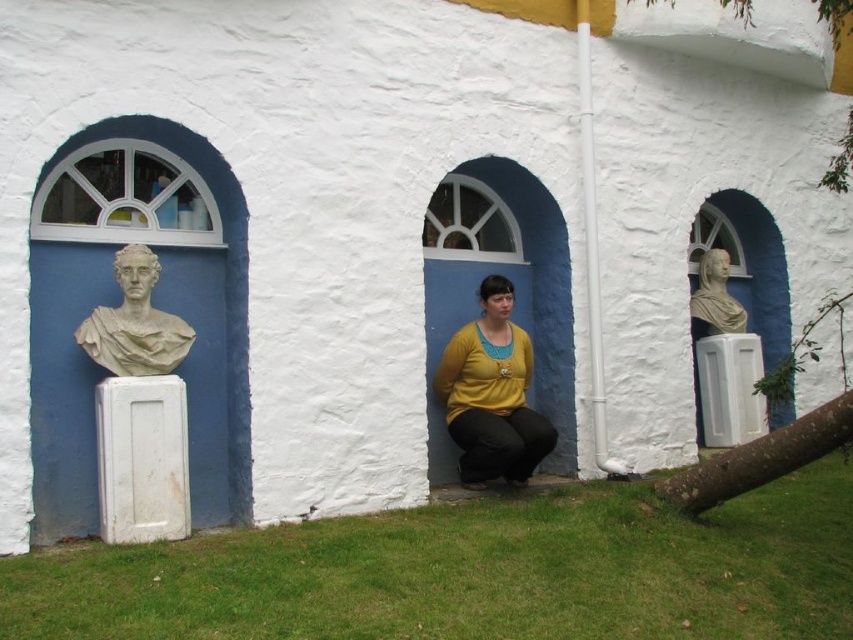
Question: Among these points, which one is nearest to the camera?

Choices:
 (A) (711, 324)
 (B) (788, 397)
 (C) (164, 362)

Answer: (B)

Question: Which point is farther to the camera?

Choices:
 (A) [500, 435]
 (B) [740, 308]
 (C) [113, 321]

Answer: (B)

Question: Which point is closer to the camera?

Choices:
 (A) (166, 317)
 (B) (712, 321)
 (C) (805, 353)
 (D) (473, 404)

Answer: (A)

Question: Is white marble bust at left further to camera compared to white marble bust at center right?

Choices:
 (A) yes
 (B) no

Answer: (B)

Question: In this image, where is white marble bust at left located relative to white marble bust at center right?

Choices:
 (A) left
 (B) right

Answer: (A)

Question: Is white marble bust at left to the right of white marble bust at center right from the viewer's perspective?

Choices:
 (A) no
 (B) yes

Answer: (A)